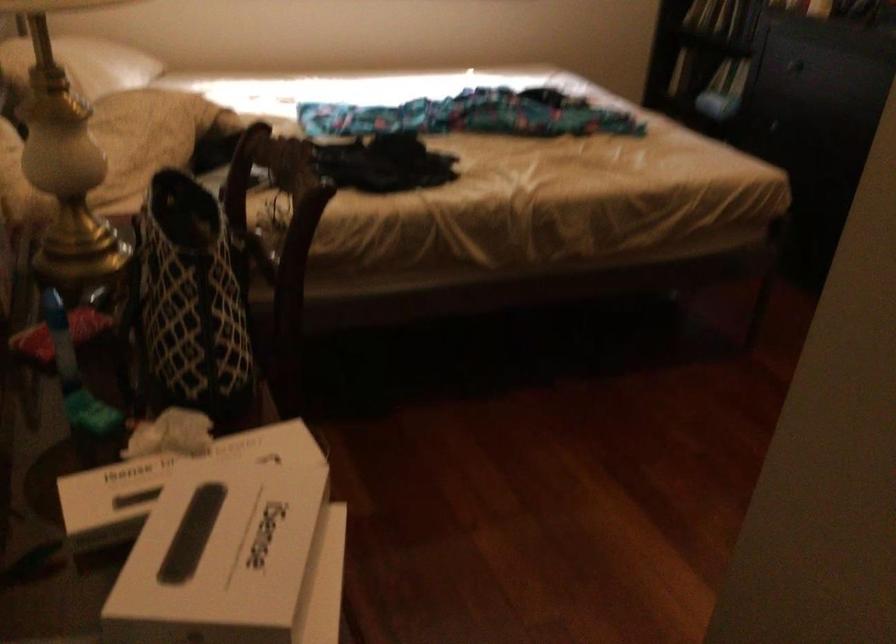
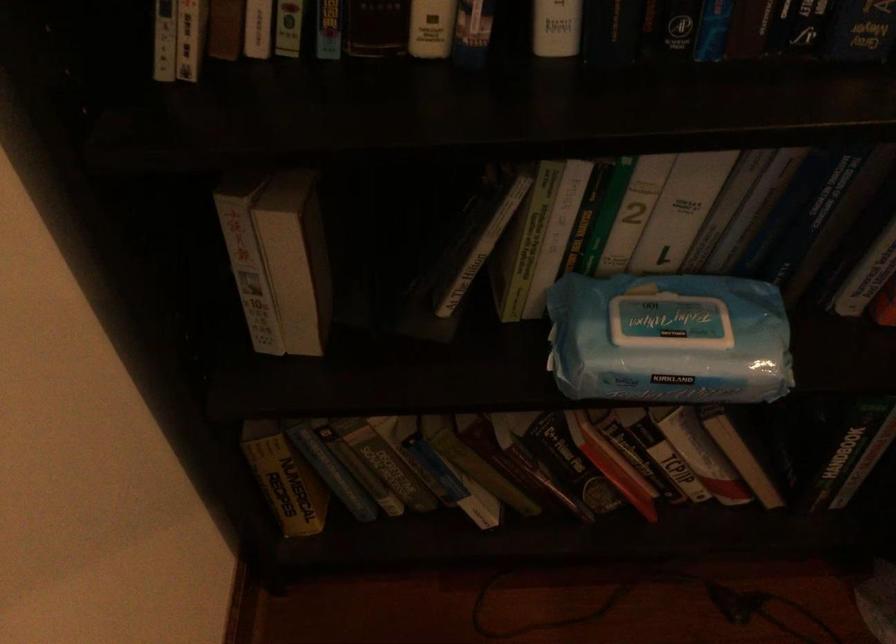
In the second image, find the point that corresponds to the point at 735,80 in the first image.

(673, 317)